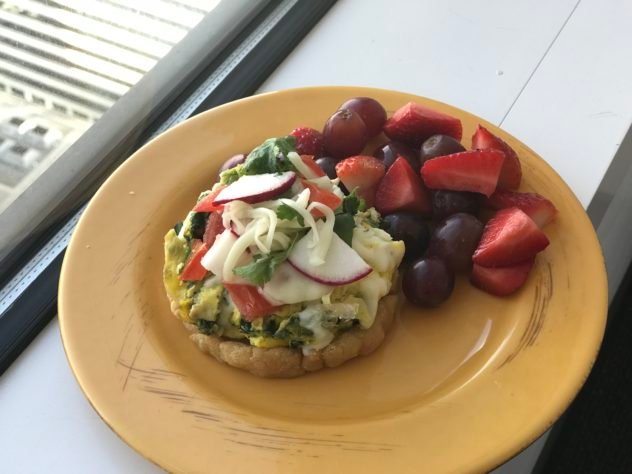
The width and height of the screenshot is (632, 474). I want to click on window sill, so click(493, 76).